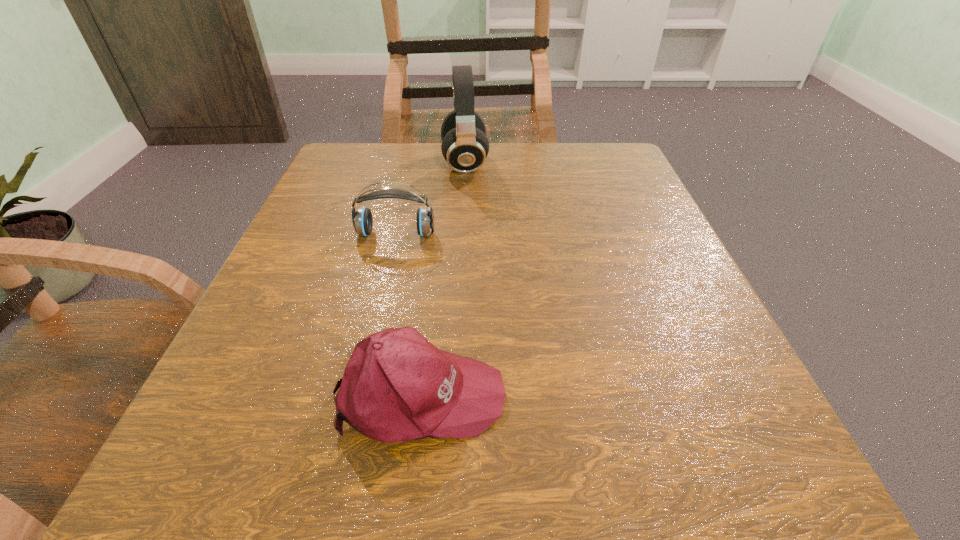
Locate which object ranks in proximity to the taller headset. Please provide its 2D coordinates. Your answer should be formatted as a tuple, i.e. [(x, y)], where the tuple contains the x and y coordinates of a point satisfying the conditions above.

[(362, 220)]

Locate an element on the screen. object that can be found as the closest to the shorter headset is located at coordinates (465, 146).

At what (x,y) coordinates should I click in order to perform the action: click on vacant region that satisfies the following two spatial constraints: 1. on the ear cups of the tallest object; 2. on the ear cups of the second farthest object. Please return your answer as a coordinate pair (x, y). Looking at the image, I should click on (462, 234).

You are a GUI agent. You are given a task and a screenshot of the screen. Output one action in this format:
    pyautogui.click(x=<x>, y=<y>)
    Task: Click on the vacant region that satisfies the following two spatial constraints: 1. on the ear cups of the taller headset; 2. on the ear cups of the second farthest object
    The width and height of the screenshot is (960, 540).
    Given the screenshot: What is the action you would take?
    pyautogui.click(x=462, y=234)

Where is `free region that satisfies the following two spatial constraints: 1. on the ear cups of the farther headset; 2. on the ear cups of the second farthest object`? free region that satisfies the following two spatial constraints: 1. on the ear cups of the farther headset; 2. on the ear cups of the second farthest object is located at coordinates (462, 234).